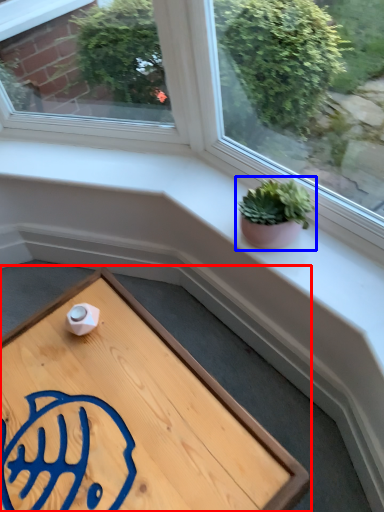
Question: Which object appears closest to the camera in this image, table (highlighted by a red box) or houseplant (highlighted by a blue box)?

Choices:
 (A) table
 (B) houseplant

Answer: (A)